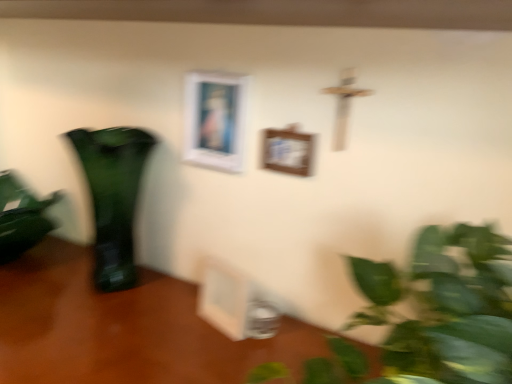
Question: Considering the relative sizes of wooden picture frame at center, acting as the first picture frame starting from the bottom, and wooden picture frame at center, which ranks as the 2th picture frame in bottom-to-top order, in the image provided, is wooden picture frame at center, acting as the first picture frame starting from the bottom, taller than wooden picture frame at center, which ranks as the 2th picture frame in bottom-to-top order,?

Choices:
 (A) yes
 (B) no

Answer: (A)

Question: Would you say wooden picture frame at center, acting as the first picture frame starting from the bottom, is a long distance from wooden picture frame at center, marked as the second picture frame in a top-to-bottom arrangement?

Choices:
 (A) no
 (B) yes

Answer: (A)

Question: Does wooden picture frame at center, the third picture frame when ordered from top to bottom, have a lesser height compared to wooden picture frame at center, which ranks as the 2th picture frame in bottom-to-top order?

Choices:
 (A) no
 (B) yes

Answer: (A)

Question: Does wooden picture frame at center, acting as the first picture frame starting from the bottom, appear on the left side of wooden picture frame at center, marked as the second picture frame in a top-to-bottom arrangement?

Choices:
 (A) no
 (B) yes

Answer: (B)

Question: Can you confirm if wooden picture frame at center, the third picture frame when ordered from top to bottom, is thinner than wooden picture frame at center, marked as the second picture frame in a top-to-bottom arrangement?

Choices:
 (A) yes
 (B) no

Answer: (B)

Question: Could you tell me if wooden picture frame at center, acting as the first picture frame starting from the bottom, is turned towards wooden picture frame at center, which ranks as the 2th picture frame in bottom-to-top order?

Choices:
 (A) no
 (B) yes

Answer: (A)

Question: Does green glass vase at left have a greater width compared to wooden table at lower left?

Choices:
 (A) no
 (B) yes

Answer: (A)

Question: From a real-world perspective, is green glass vase at left below wooden table at lower left?

Choices:
 (A) yes
 (B) no

Answer: (B)

Question: From a real-world perspective, does green glass vase at left stand above wooden table at lower left?

Choices:
 (A) no
 (B) yes

Answer: (B)

Question: From the image's perspective, is green glass vase at left located beneath wooden table at lower left?

Choices:
 (A) yes
 (B) no

Answer: (B)

Question: From the image's perspective, is green glass vase at left above wooden table at lower left?

Choices:
 (A) yes
 (B) no

Answer: (A)

Question: Does green glass vase at left turn towards wooden table at lower left?

Choices:
 (A) no
 (B) yes

Answer: (A)

Question: Considering the relative sizes of white matte picture frame at upper center, which ranks as the 3th picture frame in bottom-to-top order, and wooden table at lower left in the image provided, is white matte picture frame at upper center, which ranks as the 3th picture frame in bottom-to-top order, taller than wooden table at lower left?

Choices:
 (A) yes
 (B) no

Answer: (B)